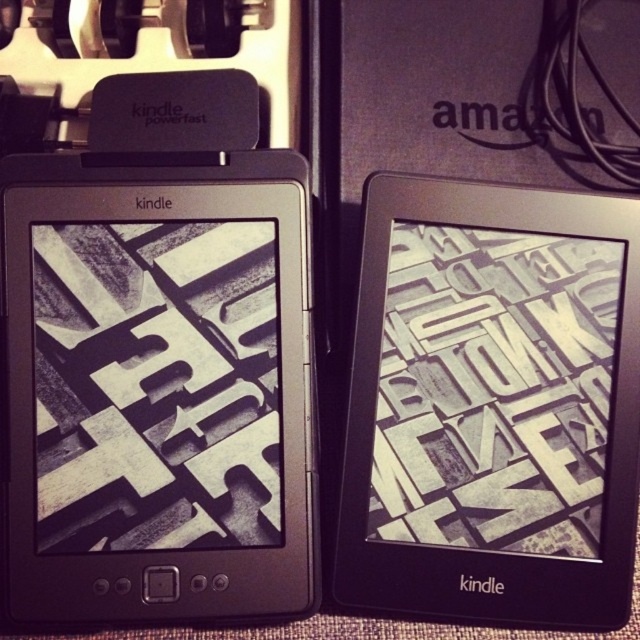
Which is below, black matte e-reader at left or black matte kindle at right?

black matte kindle at right is below.

What are the coordinates of `black matte e-reader at left` in the screenshot? It's located at (156, 387).

What do you see at coordinates (156, 387) in the screenshot? I see `black matte e-reader at left` at bounding box center [156, 387].

The width and height of the screenshot is (640, 640). Identify the location of black matte e-reader at left. (156, 387).